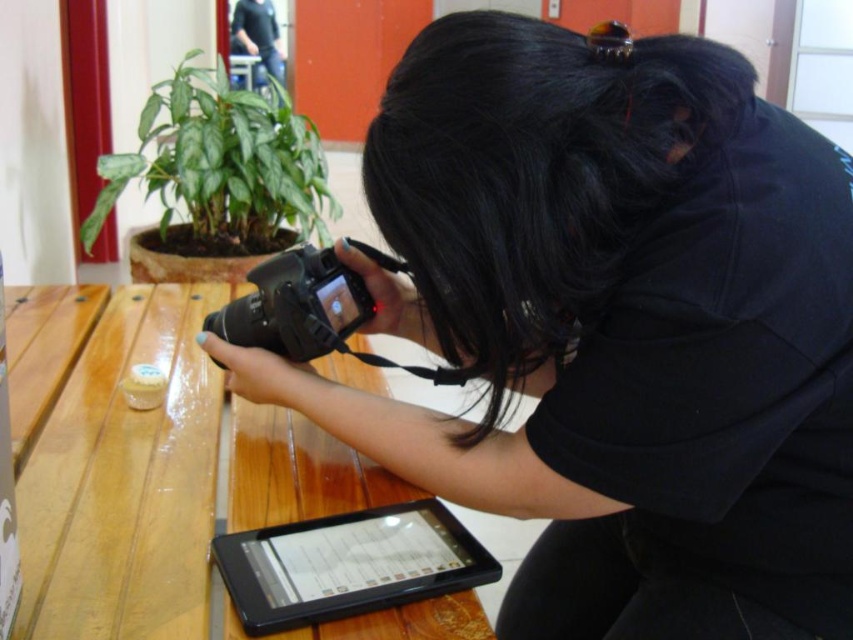
Question: Does green matte plant at upper left appear over black plastic tablet at lower center?

Choices:
 (A) yes
 (B) no

Answer: (A)

Question: Does green matte plant at upper left come in front of dark blue shirt at upper center?

Choices:
 (A) yes
 (B) no

Answer: (A)

Question: Which object is closer to the camera taking this photo?

Choices:
 (A) dark blue shirt at upper center
 (B) black plastic tablet at lower center

Answer: (B)

Question: Estimate the real-world distances between objects in this image. Which object is farther from the green matte plant at upper left?

Choices:
 (A) wooden table at center
 (B) dark blue shirt at upper center
 (C) black matte camera at center
 (D) black plastic tablet at lower center

Answer: (B)

Question: Does green matte plant at upper left appear under black plastic tablet at lower center?

Choices:
 (A) yes
 (B) no

Answer: (B)

Question: Among these objects, which one is nearest to the camera?

Choices:
 (A) wooden table at center
 (B) black plastic tablet at lower center
 (C) dark blue shirt at upper center
 (D) black matte camera at center

Answer: (A)